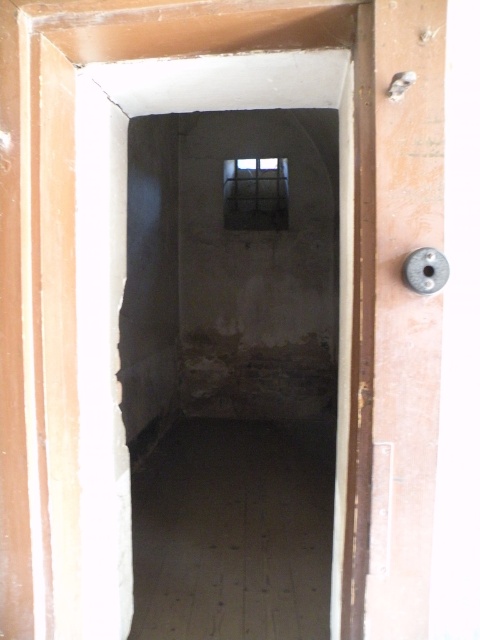
Question: Is smooth concrete basement at center wider than wooden door knob at right?

Choices:
 (A) yes
 (B) no

Answer: (A)

Question: From the image, what is the correct spatial relationship of smooth concrete basement at center in relation to wooden door knob at right?

Choices:
 (A) below
 (B) above

Answer: (A)

Question: Which object is the closest to the smooth concrete basement at center?

Choices:
 (A) transparent glass window at center
 (B) wooden door knob at right

Answer: (B)

Question: Is smooth concrete basement at center positioned at the back of wooden door knob at right?

Choices:
 (A) yes
 (B) no

Answer: (A)

Question: Which is farther from the transparent glass window at center?

Choices:
 (A) wooden door knob at right
 (B) smooth concrete basement at center

Answer: (A)

Question: Which point is farther to the camera?

Choices:
 (A) (261, 166)
 (B) (231, 448)

Answer: (A)